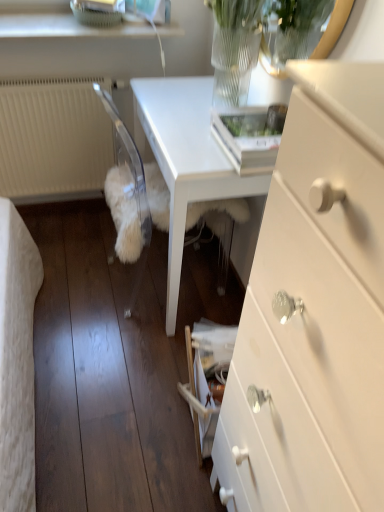
Find the location of a particular element. This screenshot has height=512, width=384. vacant space underneath white textured radiator at left (from a real-world perspective) is located at coordinates (70, 206).